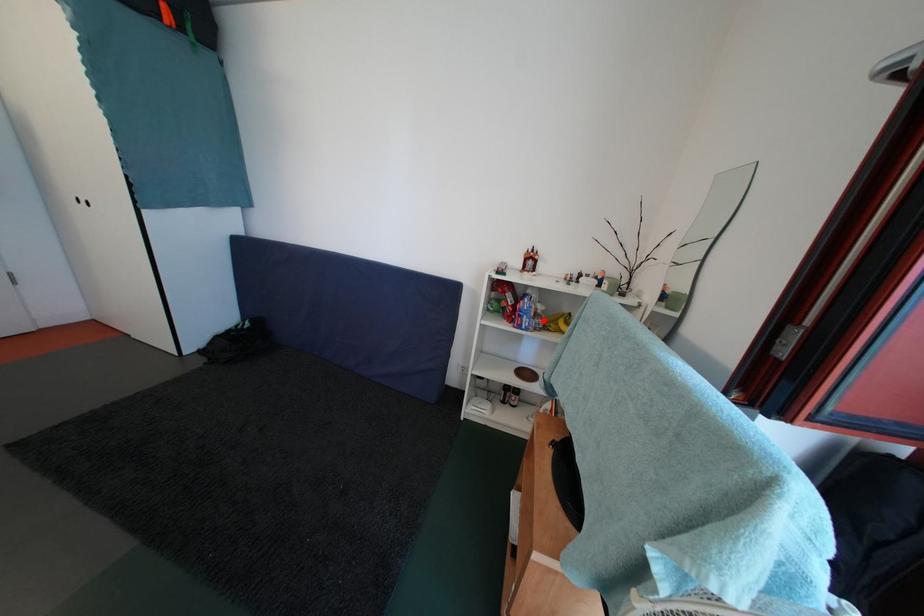
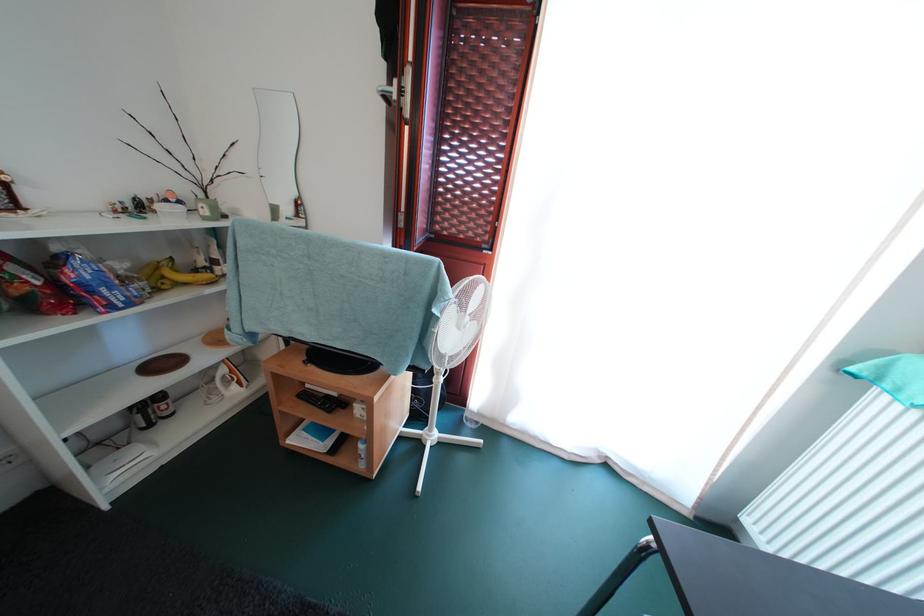
Find the pixel in the second image that matches the highlighted location in the first image.

(131, 285)